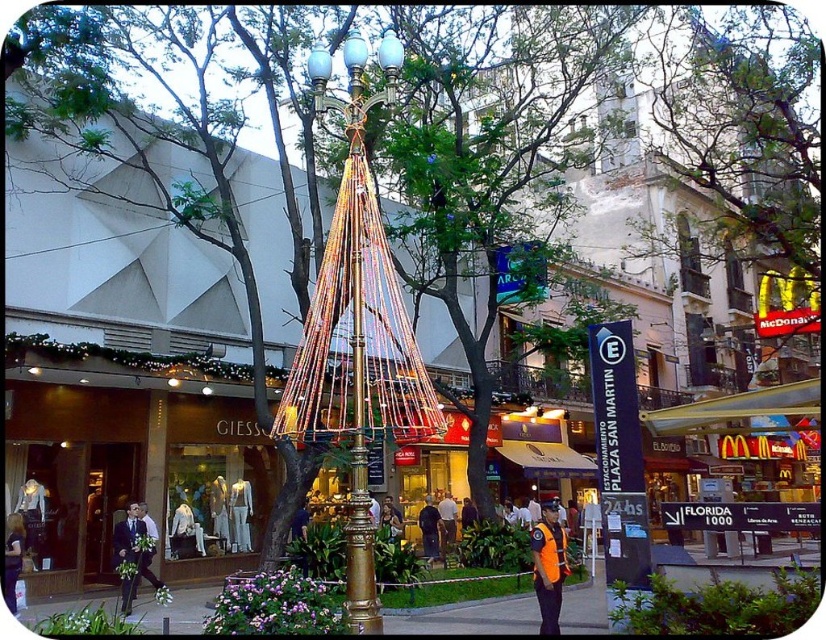
Question: Considering the real-world distances, which object is farthest from the gold metallic lamp post at center?

Choices:
 (A) white fabric dress at center
 (B) orange fabric shirt at center
 (C) reflective orange vest at lower right
 (D) dark blue jeans at center

Answer: (D)

Question: Which point is farther from the camera taking this photo?

Choices:
 (A) (226, 484)
 (B) (347, 545)
 (C) (236, 513)

Answer: (A)

Question: Does white fabric dress at center have a greater width compared to white cotton dress at center?

Choices:
 (A) no
 (B) yes

Answer: (B)

Question: Can you confirm if light brown leather jacket at center is positioned above orange fabric shirt at center?

Choices:
 (A) yes
 (B) no

Answer: (B)

Question: Among these objects, which one is farthest from the camera?

Choices:
 (A) orange fabric shirt at center
 (B) light brown leather jacket at center

Answer: (B)

Question: In this image, where is matte black suit at lower left located relative to dark blue shirt at center?

Choices:
 (A) right
 (B) left

Answer: (B)